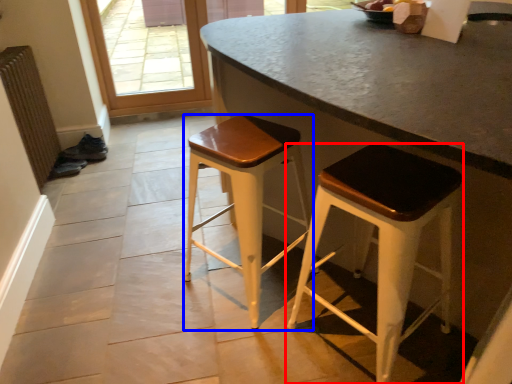
Question: Which object appears closest to the camera in this image, stool (highlighted by a red box) or stool (highlighted by a blue box)?

Choices:
 (A) stool
 (B) stool

Answer: (A)